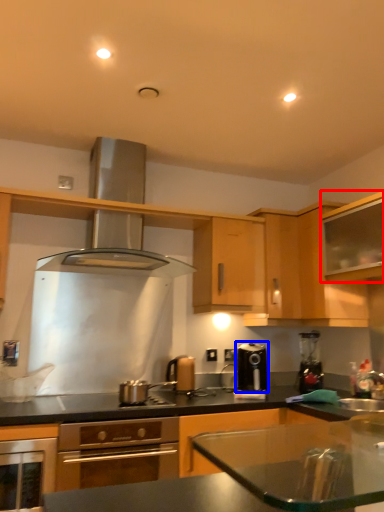
Question: Which object is closer to the camera taking this photo, cabinetry (highlighted by a red box) or kitchen appliance (highlighted by a blue box)?

Choices:
 (A) cabinetry
 (B) kitchen appliance

Answer: (A)